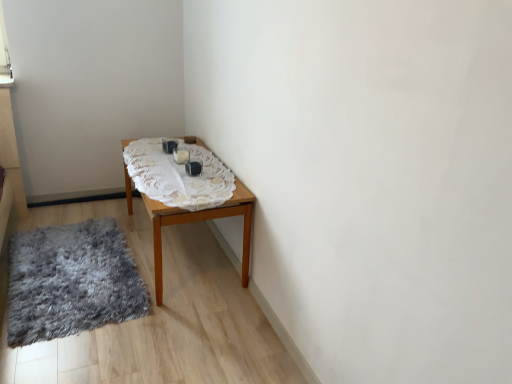
Locate an element on the screen. This screenshot has height=384, width=512. vacant area located to the right-hand side of shaggy gray rug at lower left is located at coordinates point(190,293).